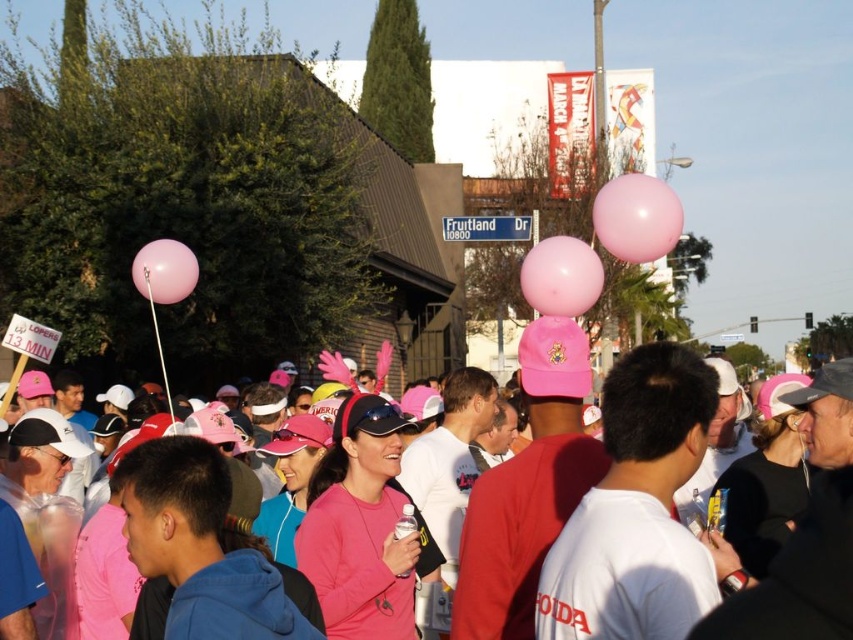
Question: Which point is farther to the camera?

Choices:
 (A) (167, 300)
 (B) (650, 256)
 (C) (811, 394)
 (D) (577, 275)

Answer: (B)

Question: Among these objects, which one is farthest from the camera?

Choices:
 (A) pink matte balloon at center
 (B) pink rubber balloon at upper right

Answer: (B)

Question: Considering the real-world distances, which object is farthest from the pink rubber balloon at center?

Choices:
 (A) pink rubber balloon at upper right
 (B) pink matte balloon at center

Answer: (B)

Question: Is pink rubber balloon at upper right below pink rubber balloon at center?

Choices:
 (A) no
 (B) yes

Answer: (A)

Question: Is pink matte balloon at center smaller than pink rubber balloon at upper left?

Choices:
 (A) no
 (B) yes

Answer: (A)

Question: Can you confirm if pink rubber balloon at center is positioned to the left of pink rubber balloon at upper left?

Choices:
 (A) no
 (B) yes

Answer: (A)